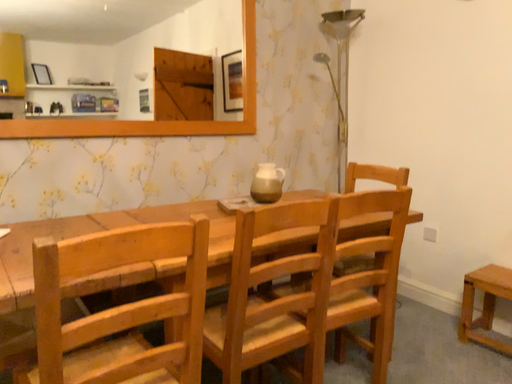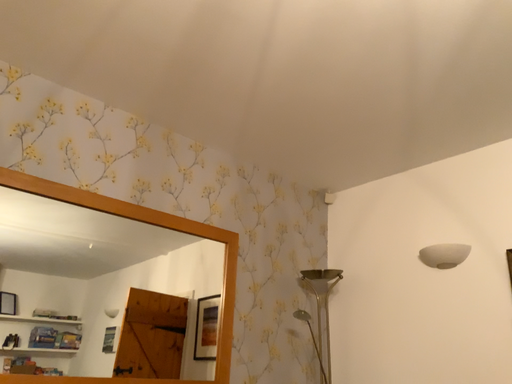
Question: How did the camera likely rotate when shooting the video?

Choices:
 (A) rotated upward
 (B) rotated downward

Answer: (A)